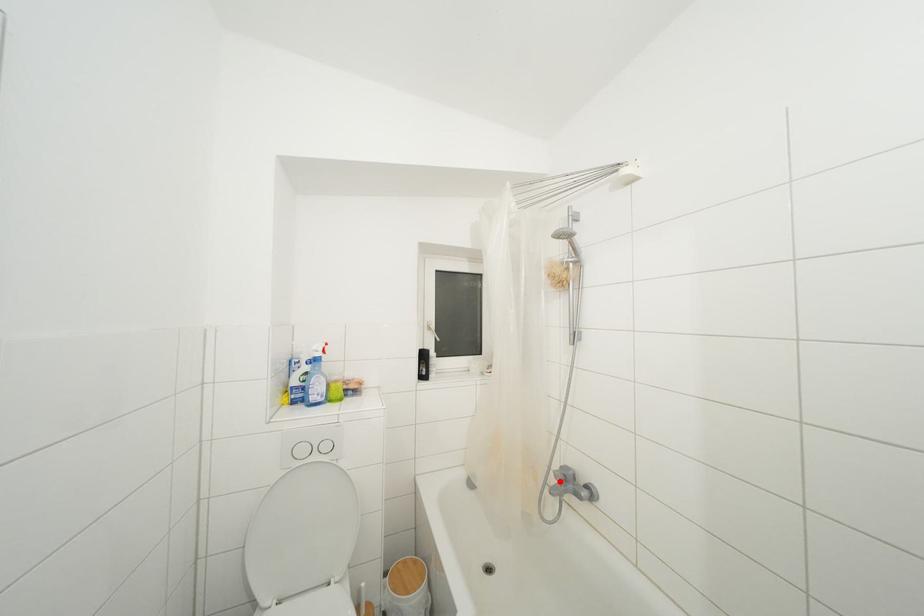
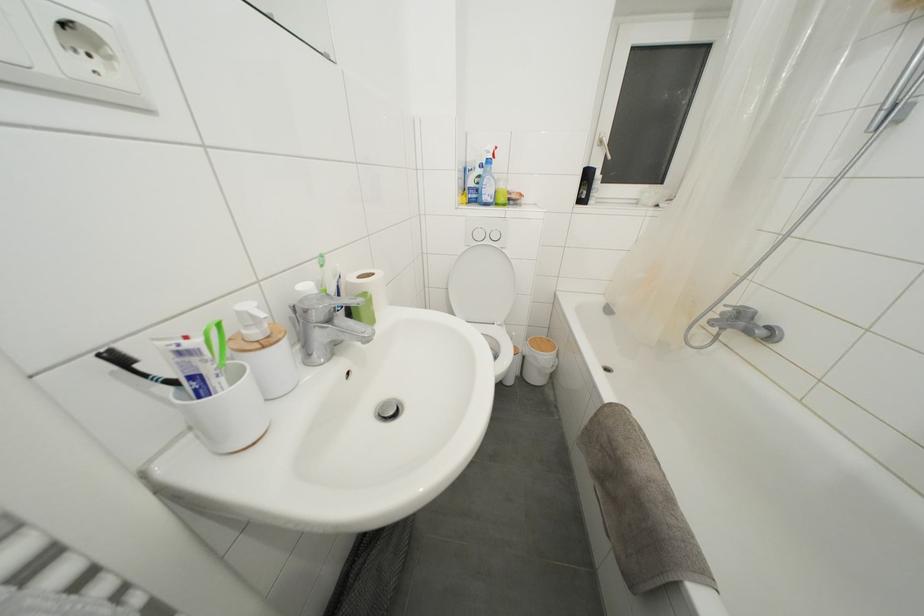
Question: I am providing you with two images of the same scene from different viewpoints. A red point is shown in image1. For the corresponding object point in image2, is it positioned nearer or farther from the camera?

Choices:
 (A) Nearer
 (B) Farther

Answer: (A)